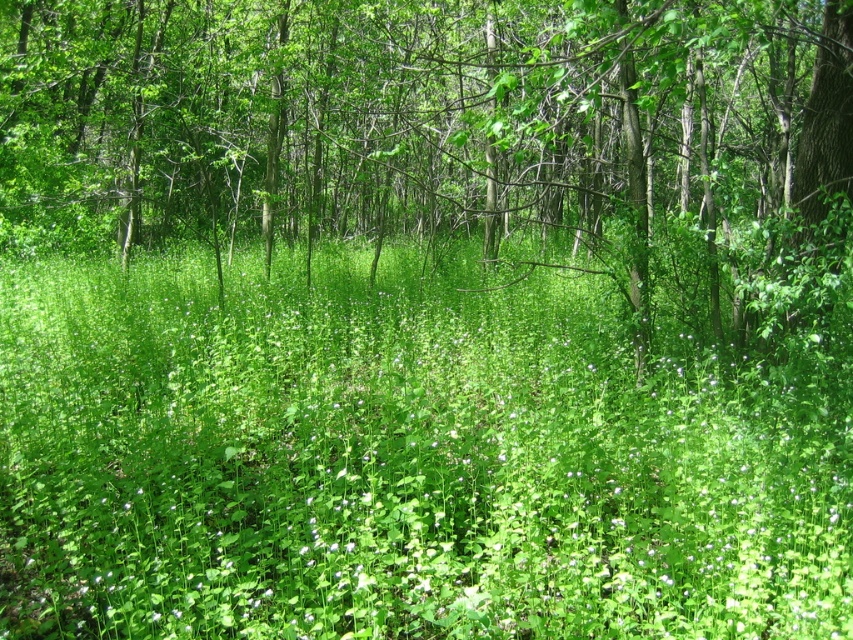
Which is in front, point (828, 630) or point (502, 145)?

Point (828, 630)

Does point (259, 573) come closer to viewer compared to point (440, 44)?

Yes.

The width and height of the screenshot is (853, 640). What are the coordinates of `green leafy grass at center` in the screenshot? It's located at (404, 460).